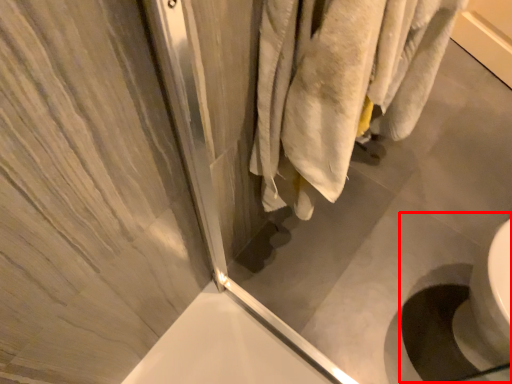
Question: In this image, where is sink (annotated by the red box) located relative to screen door?

Choices:
 (A) left
 (B) right

Answer: (B)